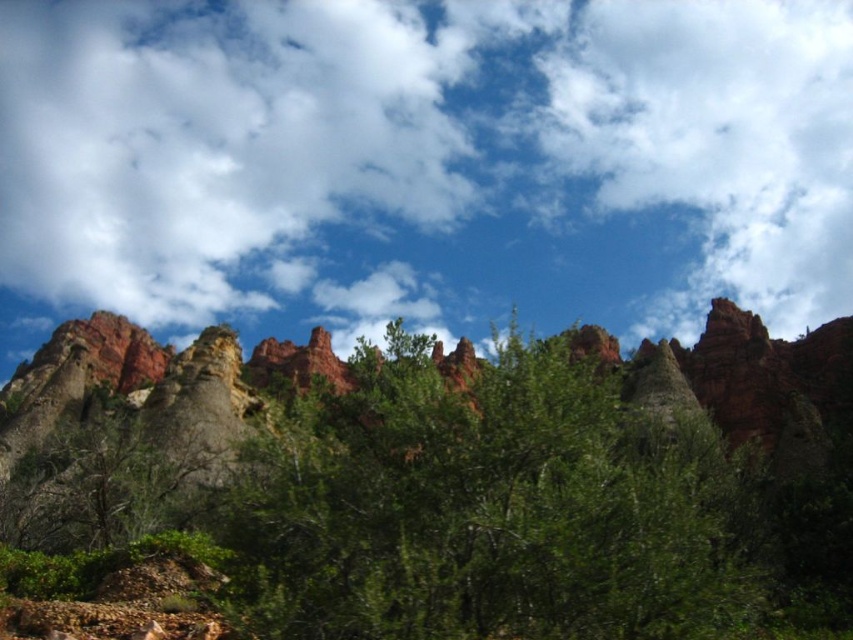
Between point (61, 140) and point (392, 403), which one is positioned behind?

Positioned behind is point (61, 140).

From the picture: Between white fluffy cloud at upper center and green leafy tree at center, which one is positioned higher?

Positioned higher is white fluffy cloud at upper center.

Between point (490, 218) and point (490, 440), which one is positioned behind?

The point (490, 218) is more distant.

At what (x,y) coordinates should I click in order to perform the action: click on white fluffy cloud at upper center. Please return your answer as a coordinate pair (x, y). Looking at the image, I should click on (422, 164).